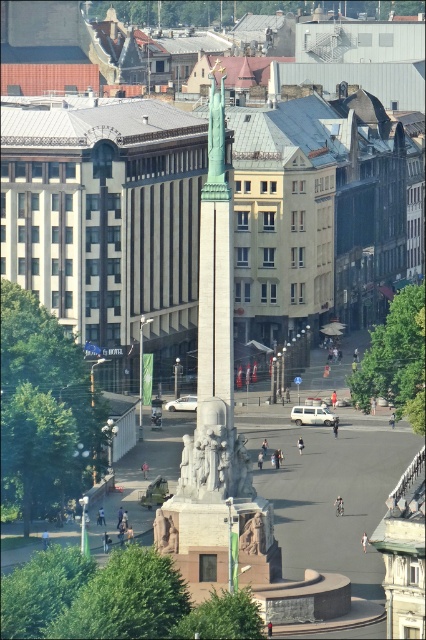
You are a tourist standing at the edge of the urban square and want to take a photo of both the polished stone obelisk at center and the rustic stone statue at center. Which direction should you face to ensure both are visible in your camera frame?

You should face to the right so that both the polished stone obelisk at center and the rustic stone statue at center are visible in your frame, as the polished stone obelisk at center is positioned to the left of the rustic stone statue at center.

You are a city planner reviewing the urban square layout. You need to determine if the polished stone obelisk at center can be moved closer to the modern building on the left without overlapping with the rustic stone statue at center. Given their widths, which object requires more space when moving?

The polished stone obelisk at center has a larger width than the rustic stone statue at center, so it requires more space when moving.